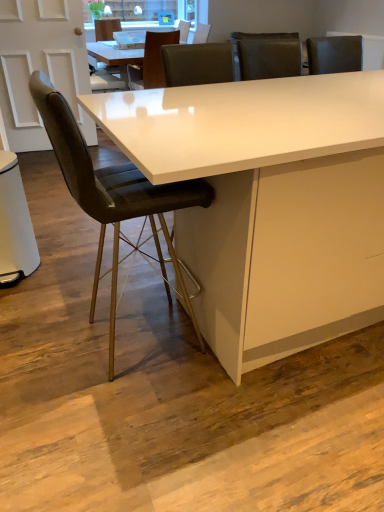
Locate an element on the screen. vacant space in front of leather-like black chair at left, which is the 3th chair from top to bottom is located at coordinates (132, 418).